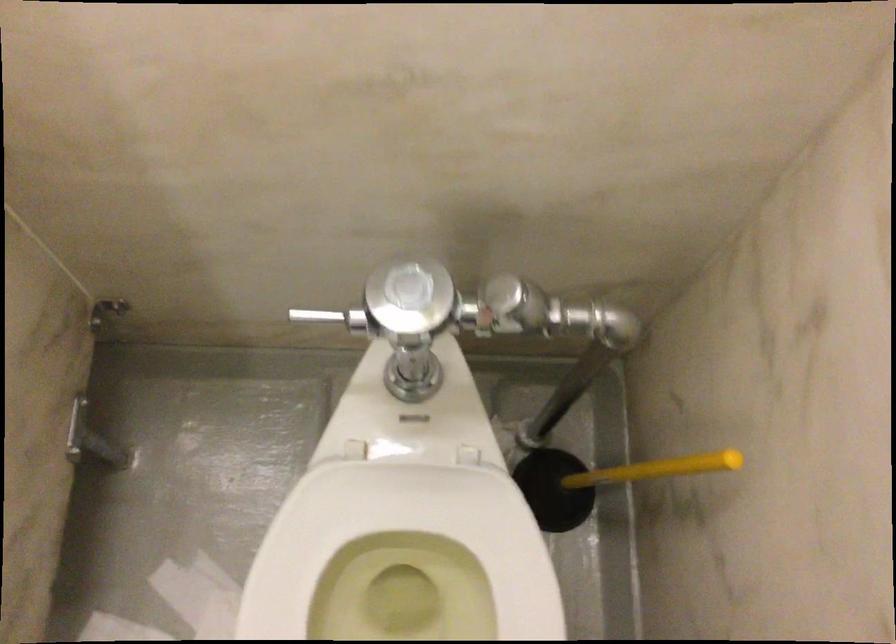
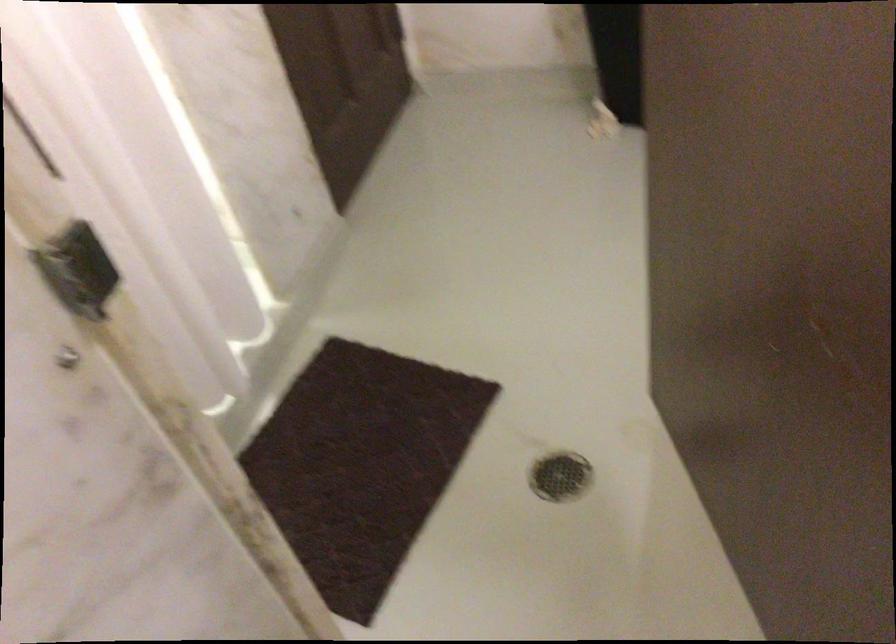
The images are taken continuously from a first-person perspective. In which direction is your viewpoint rotating?

The camera's rotation is toward left-down.